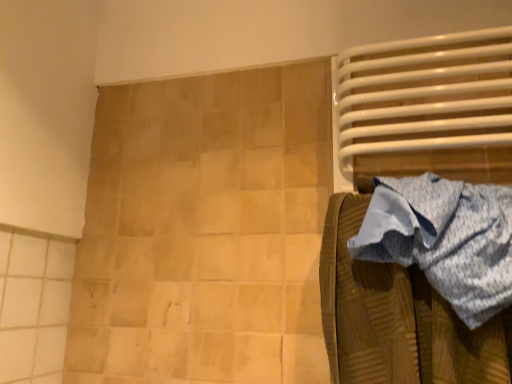
Question: Should I look upward or downward to see white metal bed at right?

Choices:
 (A) down
 (B) up

Answer: (B)